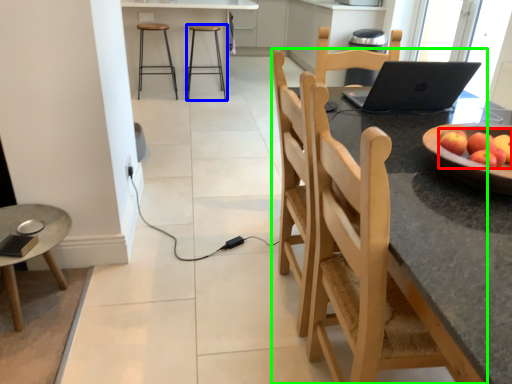
Question: Considering the real-world distances, which object is farthest from apple (highlighted by a red box)? stool (highlighted by a blue box) or chair (highlighted by a green box)?

Choices:
 (A) stool
 (B) chair

Answer: (A)